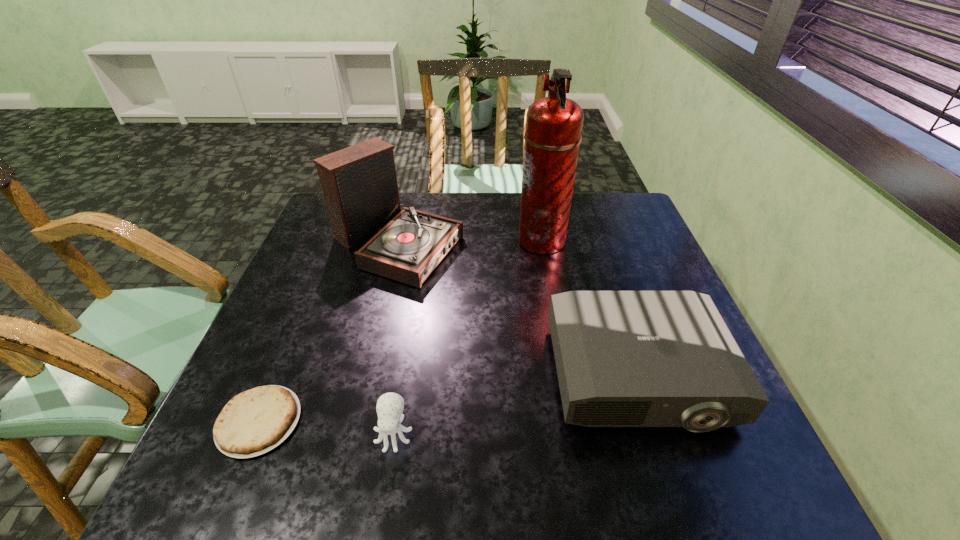
I want to click on free space located 0.230m on the right of the tortilla, so click(417, 422).

Where is `fire extinguisher that is positioned at the far edge`? fire extinguisher that is positioned at the far edge is located at coordinates (554, 124).

The height and width of the screenshot is (540, 960). In order to click on phonograph record that is at the far edge in this screenshot , I will do `click(359, 183)`.

Where is `octopus that is at the near edge`? octopus that is at the near edge is located at coordinates (x=390, y=406).

Where is `tortilla positioned at the near edge`? Image resolution: width=960 pixels, height=540 pixels. tortilla positioned at the near edge is located at coordinates (254, 422).

I want to click on phonograph record at the left edge, so click(x=359, y=183).

Where is `tortilla present at the left edge`? tortilla present at the left edge is located at coordinates (254, 422).

You are a GUI agent. You are given a task and a screenshot of the screen. Output one action in this format:
    pyautogui.click(x=<x>, y=<y>)
    Task: Click on the object that is positioned at the right edge
    This screenshot has height=540, width=960.
    Given the screenshot: What is the action you would take?
    pyautogui.click(x=624, y=358)

What are the coordinates of `object that is at the far left corner` in the screenshot? It's located at (359, 183).

I want to click on object that is positioned at the near left corner, so click(254, 422).